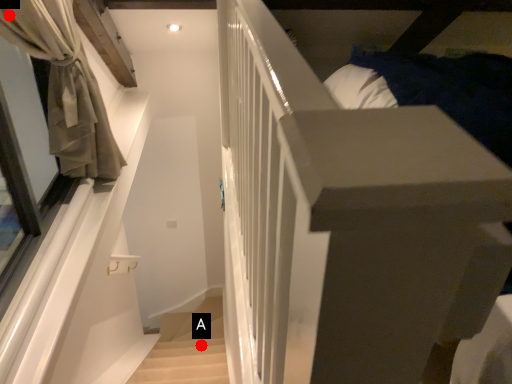
Question: Two points are circled on the image, labeled by A and B beside each circle. Which of the following is the closest to the observer?

Choices:
 (A) A is closer
 (B) B is closer

Answer: (B)